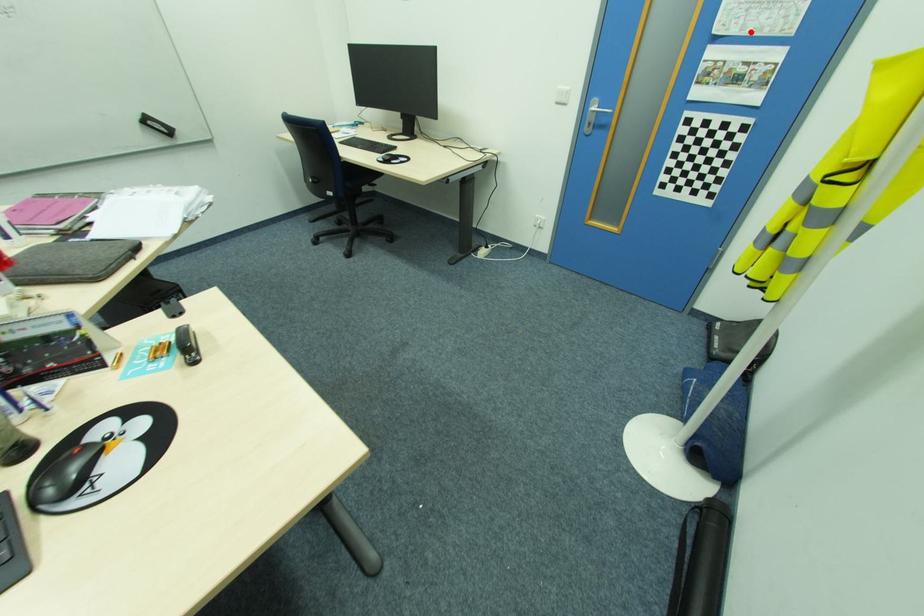
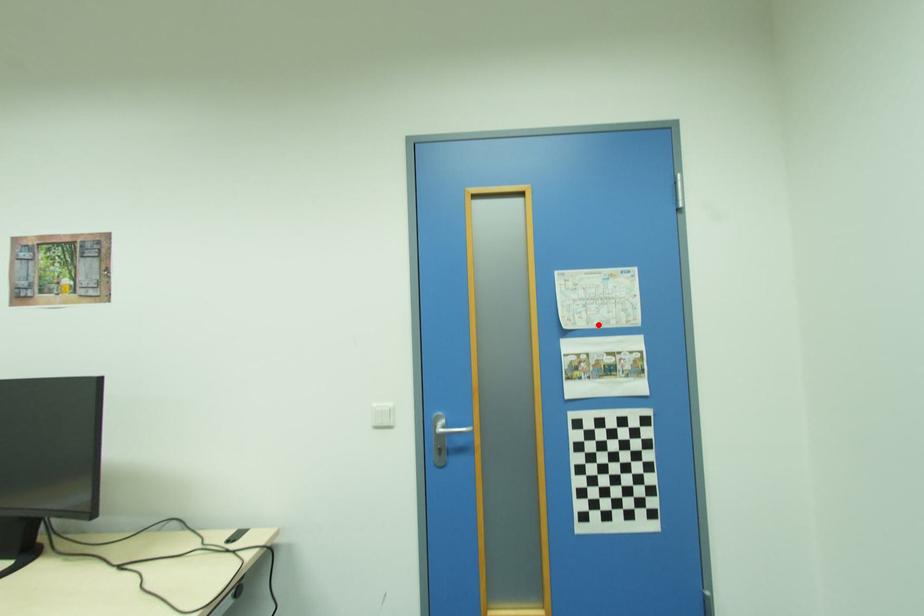
I am providing you with two images of the same scene from different viewpoints. A red point is marked on the first image and another point is marked on the second image. Does the point marked in image1 correspond to the same location as the one in image2?

Yes